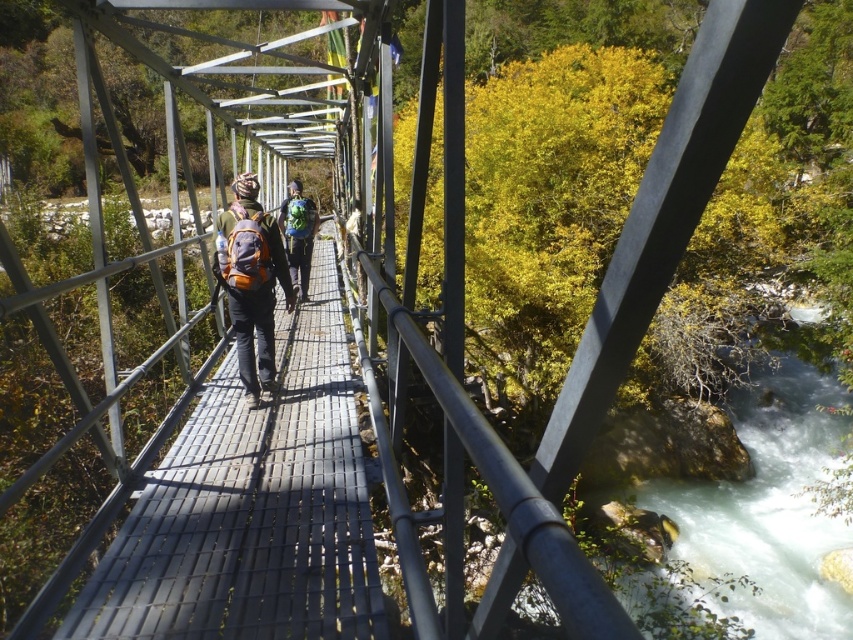
You are a hiker planning to cross the metal suspension bridge. You see two hikers with a matte orange backpack at center and a matte green backpack at center. The bridge is narrow, and you need to know if there is enough space to pass between them. Can you fit through the gap between the two backpacks if you are 2 feet wide?

The gap between the matte orange backpack at center and the matte green backpack at center is 13.39 feet. Since you are 2 feet wide, there is sufficient space to pass through the gap between them.

You are standing on the metal suspension bridge and notice a point marked at coordinates (x=251, y=282). Which object is located exactly at that point?

The point at coordinates (x=251, y=282) indicates the matte orange backpack at center.

You are standing on the metal suspension bridge and see two hikers with their backpacks. Which backpack is positioned to the right of the other? The two backpacks are the matte orange backpack at center and the matte green backpack at center.

The matte orange backpack at center is positioned to the right of the matte green backpack at center.